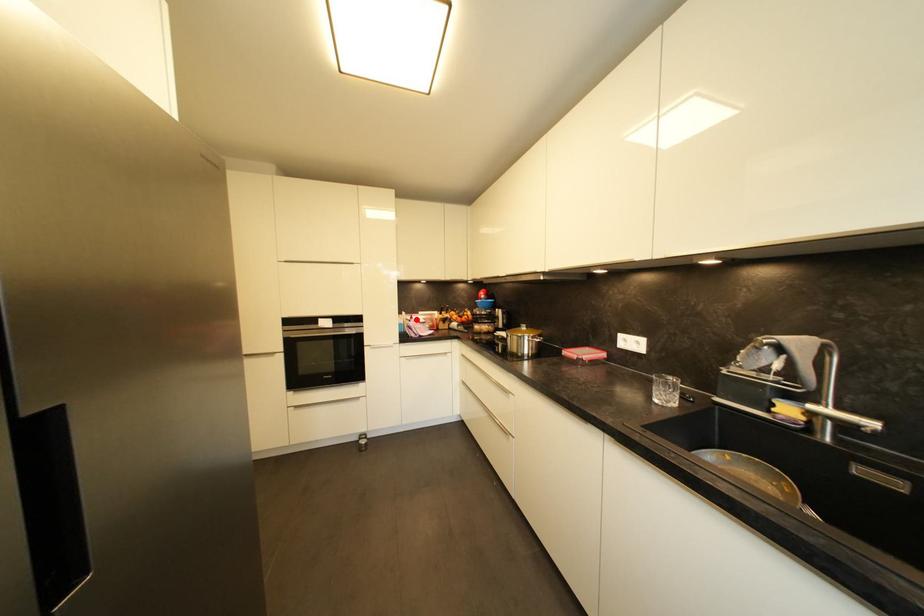
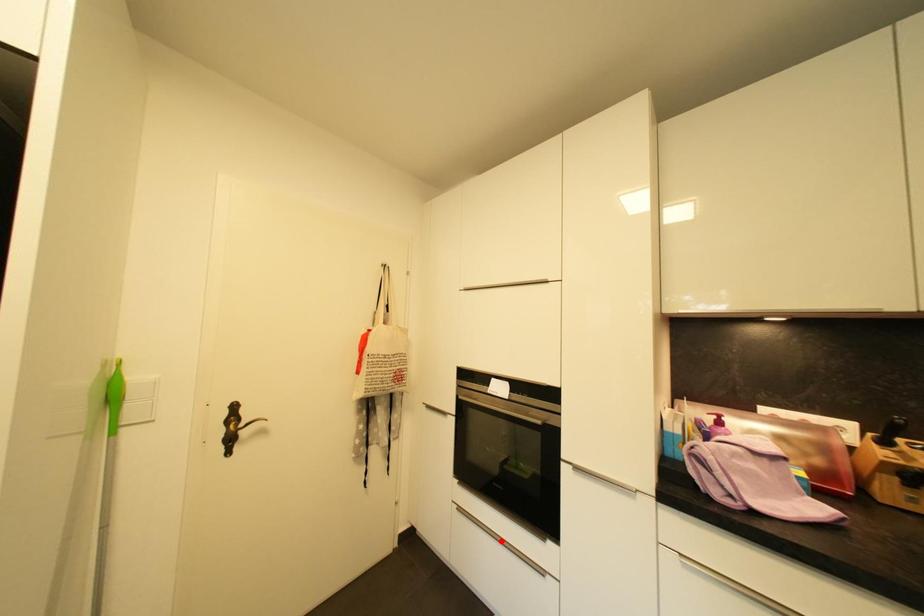
I am providing you with two images of the same scene from different viewpoints. A red point is marked on the first image and another point is marked on the second image. Are the points marked in image1 and image2 representing the same 3D position?

No